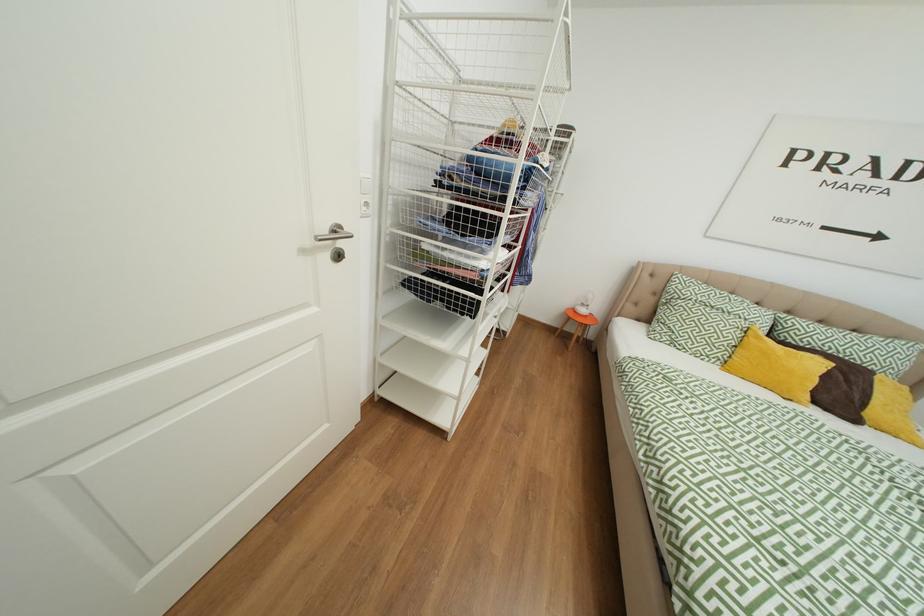
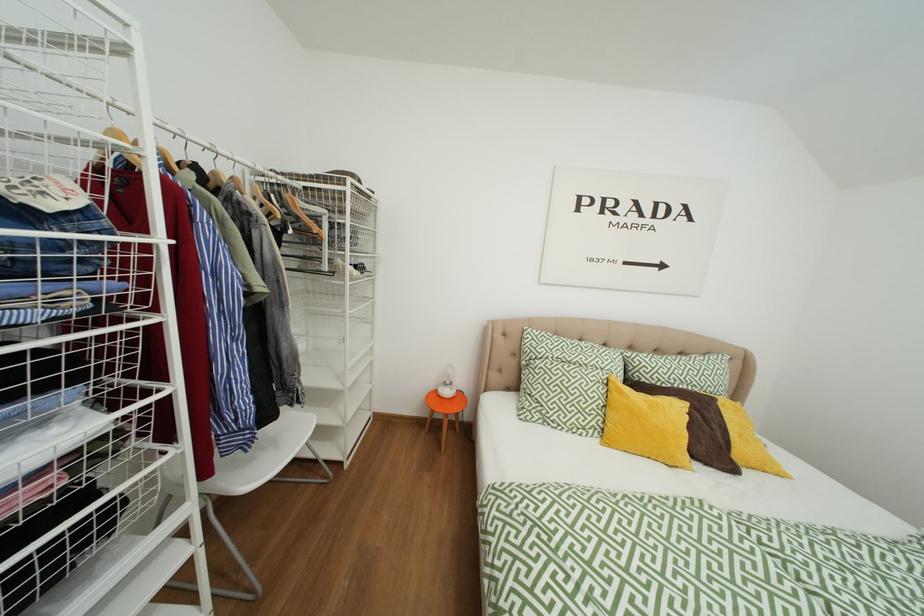
Question: The images are taken continuously from a first-person perspective. In which direction is your viewpoint rotating?

Choices:
 (A) Left
 (B) Right
 (C) Up
 (D) Down

Answer: (B)